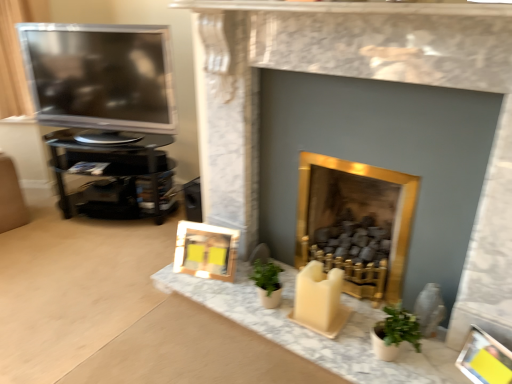
Question: From the image's perspective, is yellow paper picture frame at lower right, which appears as the second picture frame when viewed from the back, on matte gray vase at lower right?

Choices:
 (A) yes
 (B) no

Answer: (B)

Question: From a real-world perspective, is yellow paper picture frame at lower right, which appears as the second picture frame when viewed from the back, positioned over matte gray vase at lower right based on gravity?

Choices:
 (A) yes
 (B) no

Answer: (B)

Question: Is matte gray vase at lower right at the back of yellow paper picture frame at lower right, the first picture frame when ordered from front to back?

Choices:
 (A) no
 (B) yes

Answer: (A)

Question: Can you confirm if yellow paper picture frame at lower right, which is counted as the 1th picture frame, starting from the right, is smaller than matte gray vase at lower right?

Choices:
 (A) yes
 (B) no

Answer: (B)

Question: Does yellow paper picture frame at lower right, which appears as the second picture frame when viewed from the back, lie in front of matte gray vase at lower right?

Choices:
 (A) no
 (B) yes

Answer: (B)

Question: From the image's perspective, is yellow paper picture frame at lower right, the first picture frame when ordered from front to back, below matte gray vase at lower right?

Choices:
 (A) yes
 (B) no

Answer: (A)

Question: From the image's perspective, does wooden frame at lower center, which is the 2th picture frame in bottom-to-top order, appear lower than gold metallic fireplace at center, which is the 2th fireplace from left to right?

Choices:
 (A) yes
 (B) no

Answer: (A)

Question: From a real-world perspective, is wooden frame at lower center, which ranks as the first picture frame in back-to-front order, below gold metallic fireplace at center, marked as the 1th fireplace in a right-to-left arrangement?

Choices:
 (A) no
 (B) yes

Answer: (B)

Question: Considering the relative positions of wooden frame at lower center, the second picture frame when ordered from right to left, and gold metallic fireplace at center, marked as the 1th fireplace in a right-to-left arrangement, in the image provided, is wooden frame at lower center, the second picture frame when ordered from right to left, to the right of gold metallic fireplace at center, marked as the 1th fireplace in a right-to-left arrangement, from the viewer's perspective?

Choices:
 (A) yes
 (B) no

Answer: (B)

Question: Considering the relative positions of wooden frame at lower center, which is the 2th picture frame in bottom-to-top order, and gold metallic fireplace at center, marked as the 1th fireplace in a right-to-left arrangement, in the image provided, is wooden frame at lower center, which is the 2th picture frame in bottom-to-top order, to the left of gold metallic fireplace at center, marked as the 1th fireplace in a right-to-left arrangement, from the viewer's perspective?

Choices:
 (A) yes
 (B) no

Answer: (A)

Question: Does wooden frame at lower center, placed as the second picture frame when sorted from front to back, come behind gold metallic fireplace at center, which is the 2th fireplace from left to right?

Choices:
 (A) no
 (B) yes

Answer: (B)

Question: Is wooden frame at lower center, which appears as the 1th picture frame when viewed from the left, positioned far away from gold metallic fireplace at center, which is the 2th fireplace from left to right?

Choices:
 (A) yes
 (B) no

Answer: (B)

Question: From the image's perspective, is matte gray vase at lower right under satin black television at left?

Choices:
 (A) no
 (B) yes

Answer: (B)